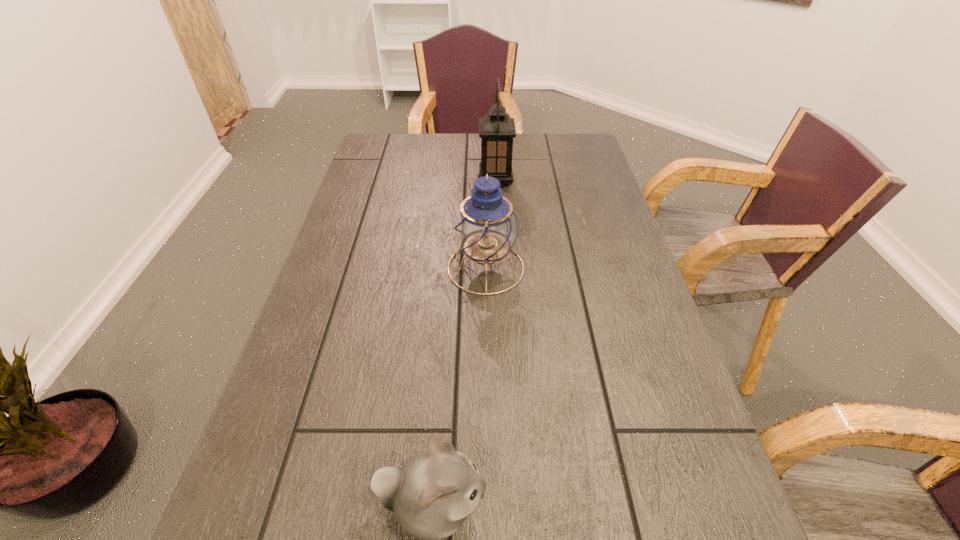
Find the location of a particular element. The image size is (960, 540). the tallest object is located at coordinates (496, 129).

At what (x,y) coordinates should I click in order to perform the action: click on the farthest object. Please return your answer as a coordinate pair (x, y). This screenshot has height=540, width=960. Looking at the image, I should click on (496, 129).

Locate an element on the screen. This screenshot has height=540, width=960. the second farthest object is located at coordinates (486, 227).

You are a GUI agent. You are given a task and a screenshot of the screen. Output one action in this format:
    pyautogui.click(x=<x>, y=<y>)
    Task: Click on the shorter lantern
    This screenshot has width=960, height=540.
    Given the screenshot: What is the action you would take?
    pyautogui.click(x=486, y=227)

Identify the location of vacant space located 0.160m on the back of the taller lantern. (493, 148).

The width and height of the screenshot is (960, 540). In order to click on vacant space located 0.210m on the front-facing side of the second farthest object in this screenshot , I will do `click(360, 268)`.

Identify the location of blank space located 0.080m on the front-facing side of the second farthest object. This screenshot has height=540, width=960. (414, 268).

The width and height of the screenshot is (960, 540). Find the location of `vacant space located on the front-facing side of the second farthest object`. vacant space located on the front-facing side of the second farthest object is located at coordinates (360, 268).

Find the location of a particular element. The image size is (960, 540). free region at the far edge of the desktop is located at coordinates (422, 164).

Where is `blank space at the left edge of the desktop`? This screenshot has width=960, height=540. blank space at the left edge of the desktop is located at coordinates (300, 341).